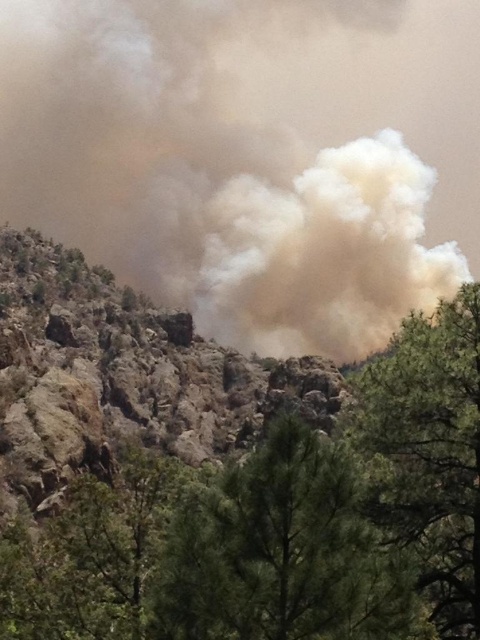
Is rugged rock cliff at center in front of green textured tree at lower center?

No, it is behind green textured tree at lower center.

Is rugged rock cliff at center smaller than green textured tree at lower center?

Incorrect, rugged rock cliff at center is not smaller in size than green textured tree at lower center.

What do you see at coordinates (121, 376) in the screenshot?
I see `rugged rock cliff at center` at bounding box center [121, 376].

The height and width of the screenshot is (640, 480). In order to click on rugged rock cliff at center in this screenshot , I will do `click(121, 376)`.

Who is taller, brown dusty cloud at center or rugged rock cliff at center?

brown dusty cloud at center

Who is more distant from viewer, (326, 148) or (213, 449)?

Point (326, 148)

Identify the location of brown dusty cloud at center. (252, 156).

Find the location of a particular element. The height and width of the screenshot is (640, 480). brown dusty cloud at center is located at coordinates (252, 156).

Does point (96, 276) come farther from viewer compared to point (455, 586)?

Yes.

Can you confirm if rugged rock cliff at center is thinner than green textured tree at center?

Incorrect, rugged rock cliff at center's width is not less than green textured tree at center's.

Where is `rugged rock cliff at center`? rugged rock cliff at center is located at coordinates 121,376.